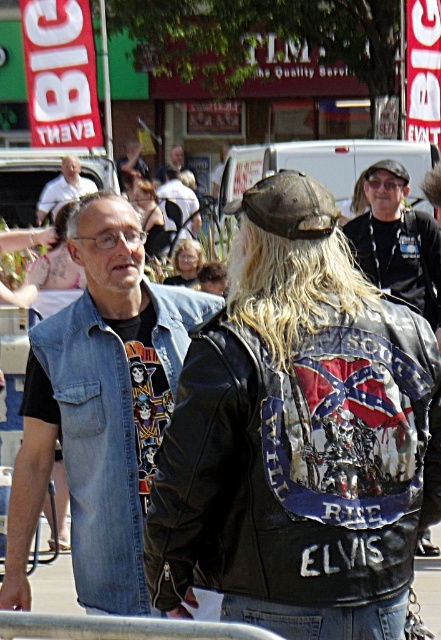
Does black leather jacket at center have a lesser width compared to denim jacket at left?

In fact, black leather jacket at center might be wider than denim jacket at left.

Is the position of black leather jacket at center more distant than that of denim jacket at left?

No, it is in front of denim jacket at left.

Find the location of a particular element. The height and width of the screenshot is (640, 441). black leather jacket at center is located at coordinates (298, 436).

Can you confirm if white leather jacket at center is positioned to the left of light brown leather jacket at center?

In fact, white leather jacket at center is to the right of light brown leather jacket at center.

Does white leather jacket at center lie behind light brown leather jacket at center?

No, white leather jacket at center is in front of light brown leather jacket at center.

Describe the element at coordinates (179, 202) in the screenshot. The width and height of the screenshot is (441, 640). I see `white leather jacket at center` at that location.

Identify the location of white leather jacket at center. (179, 202).

How much distance is there between matte black hair at upper center and blonde hair at center?

matte black hair at upper center and blonde hair at center are 7.19 meters apart.

The height and width of the screenshot is (640, 441). What do you see at coordinates (146, 212) in the screenshot?
I see `matte black hair at upper center` at bounding box center [146, 212].

Which is in front, point (153, 234) or point (201, 256)?

Point (201, 256) is in front.

You are a GUI agent. You are given a task and a screenshot of the screen. Output one action in this format:
    pyautogui.click(x=<x>, y=<y>)
    Task: Click on the matte black hair at upper center
    
    Given the screenshot: What is the action you would take?
    pyautogui.click(x=146, y=212)